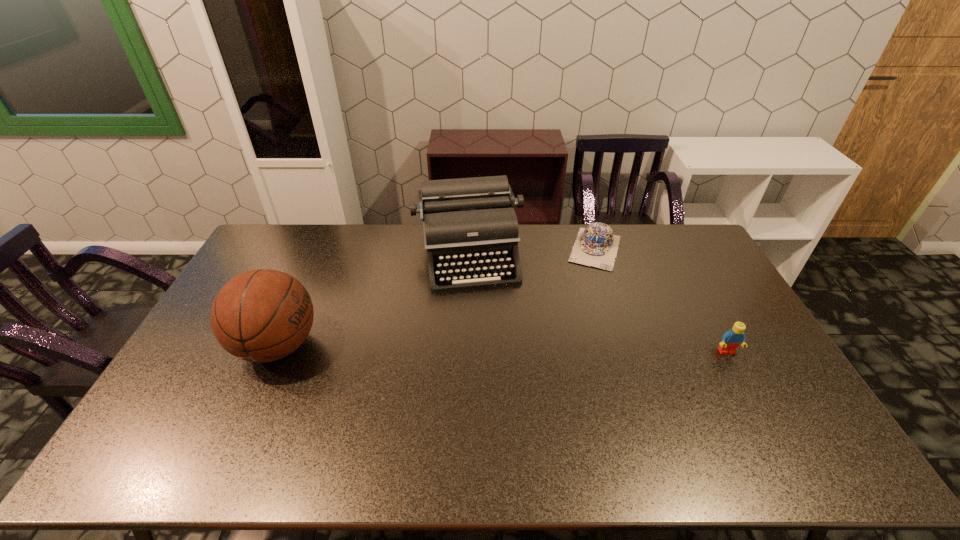
You are a GUI agent. You are given a task and a screenshot of the screen. Output one action in this format:
    pyautogui.click(x=<x>, y=<y>)
    Task: Click on the free spot between the typewriter and the rightmost object
    
    Given the screenshot: What is the action you would take?
    pyautogui.click(x=597, y=303)

I want to click on free space between the typewriter and the Lego, so click(x=597, y=303).

Where is `vacant space that's between the second object from right to left and the second object from left to right`? Image resolution: width=960 pixels, height=540 pixels. vacant space that's between the second object from right to left and the second object from left to right is located at coordinates (531, 252).

The image size is (960, 540). I want to click on unoccupied position between the second object from right to left and the third tallest object, so click(661, 300).

This screenshot has width=960, height=540. What are the coordinates of `free space that is in between the cap and the leftmost object` in the screenshot? It's located at (437, 297).

Find the location of `empty location between the Lego and the basketball`. empty location between the Lego and the basketball is located at coordinates (502, 349).

The image size is (960, 540). What are the coordinates of `free point between the cap and the third tallest object` in the screenshot? It's located at (661, 300).

The width and height of the screenshot is (960, 540). I want to click on vacant space that is in between the rightmost object and the basketball, so click(502, 349).

The width and height of the screenshot is (960, 540). Find the location of `unoccupied area between the third tallest object and the leftmost object`. unoccupied area between the third tallest object and the leftmost object is located at coordinates (502, 349).

I want to click on empty space between the second shortest object and the second object from right to left, so click(661, 300).